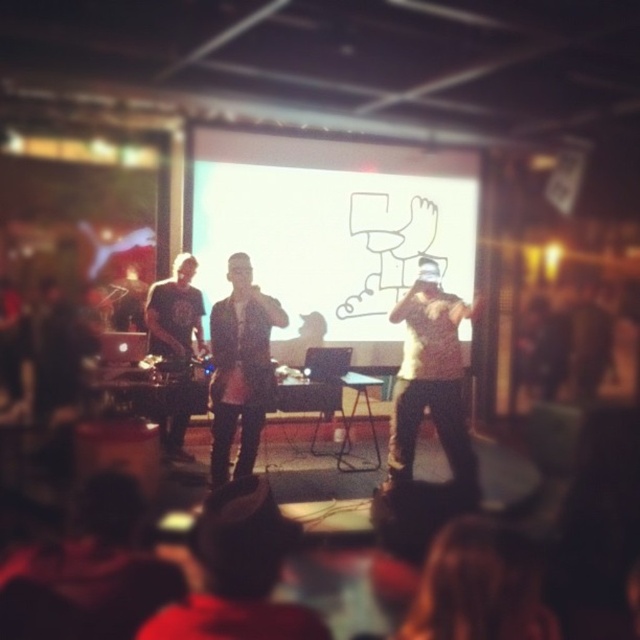
Does white matte projection screen at center have a lesser height compared to dark gray leather jacket at center?

In fact, white matte projection screen at center may be taller than dark gray leather jacket at center.

Which is in front, point (419, 180) or point (260, 384)?

Point (260, 384) is in front.

This screenshot has width=640, height=640. I want to click on white matte projection screen at center, so click(x=332, y=227).

Does white matte projection screen at center have a lesser width compared to dark gray fabric shirt at left?

No, white matte projection screen at center is not thinner than dark gray fabric shirt at left.

From the picture: Which is more to the left, white matte projection screen at center or dark gray fabric shirt at left?

From the viewer's perspective, dark gray fabric shirt at left appears more on the left side.

Which is in front, point (289, 304) or point (177, 320)?

Point (177, 320) is in front.

In order to click on white matte projection screen at center in this screenshot , I will do `click(332, 227)`.

Which is below, white matte projection screen at center or white knit hat at center?

Positioned lower is white knit hat at center.

Is point (387, 237) positioned behind point (420, 257)?

Yes.

Where is `white matte projection screen at center`? This screenshot has height=640, width=640. white matte projection screen at center is located at coordinates (332, 227).